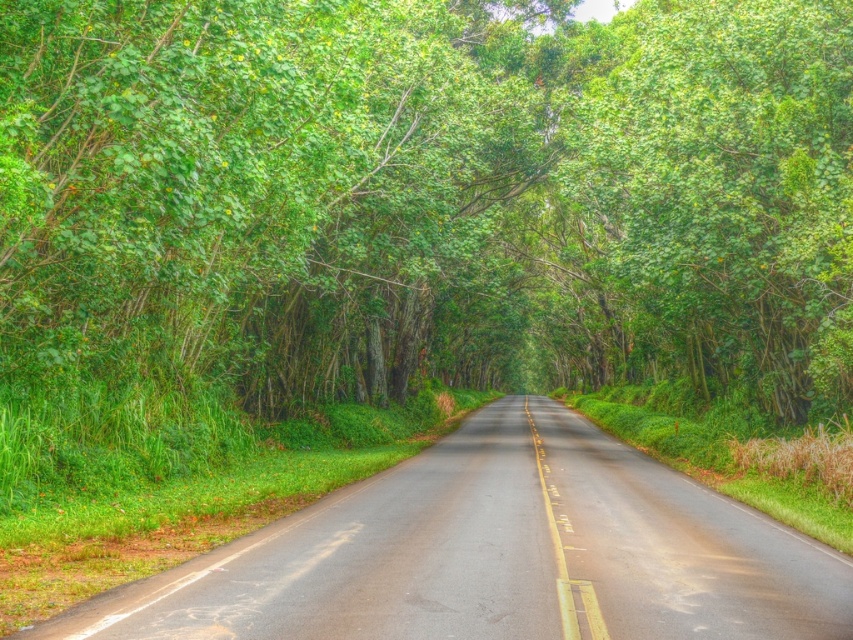
Question: Can you confirm if green leafy trees at center is positioned below yellow painted lines at center?

Choices:
 (A) yes
 (B) no

Answer: (B)

Question: Considering the relative positions of green leafy trees at center and yellow painted lines at center in the image provided, where is green leafy trees at center located with respect to yellow painted lines at center?

Choices:
 (A) below
 (B) above

Answer: (B)

Question: Which of the following is the farthest from the observer?

Choices:
 (A) green leafy trees at center
 (B) yellow painted lines at center

Answer: (A)

Question: Which object is closer to the camera taking this photo?

Choices:
 (A) yellow painted lines at center
 (B) green leafy trees at center

Answer: (A)

Question: In this image, where is green leafy trees at center located relative to yellow painted lines at center?

Choices:
 (A) below
 (B) above

Answer: (B)